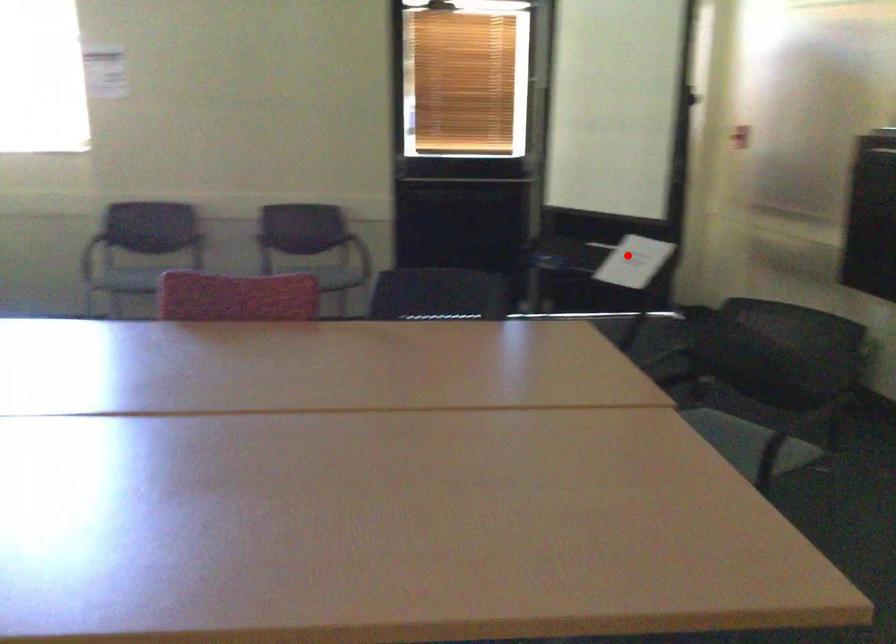
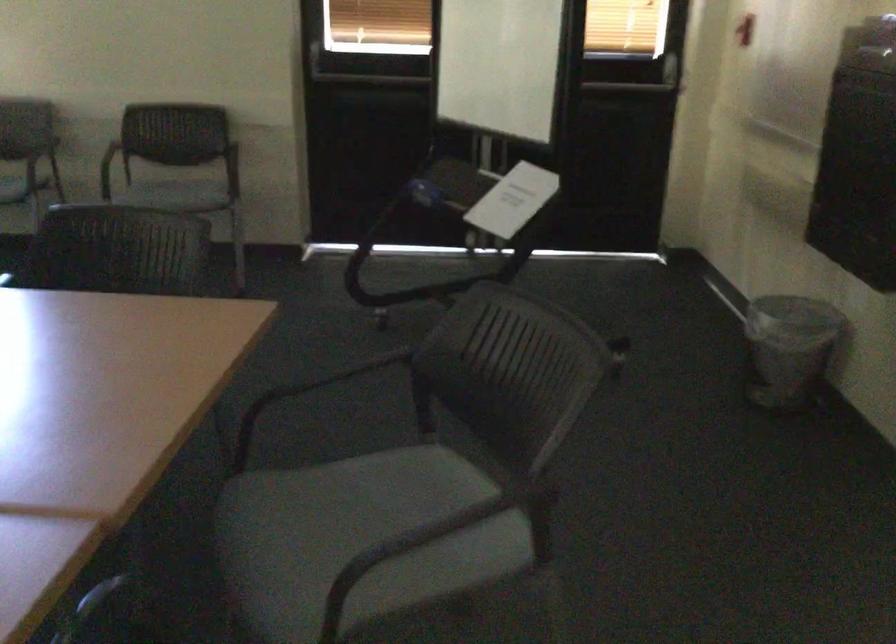
Question: I am providing you with two images of the same scene from different viewpoints. Given a red point in image1, look at the same physical point in image2. Is it:

Choices:
 (A) Closer to the viewpoint
 (B) Farther from the viewpoint

Answer: (A)